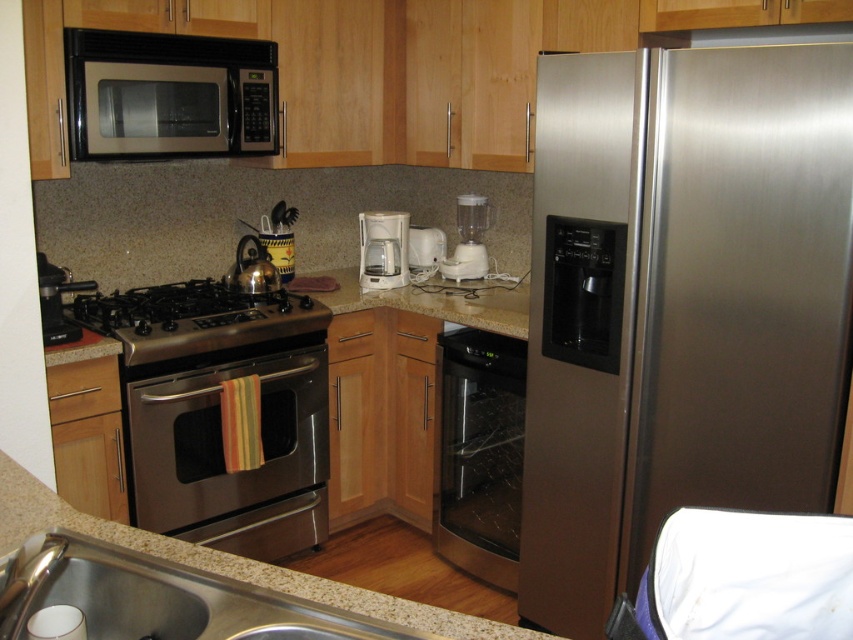
In the scene shown: You are organizing the kitchen and need to place a new appliance between the stainless steel refrigerator at right and the brushed metal sink at lower left. Based on their positions, which appliance should be placed closer to the sink?

The stainless steel refrigerator at right is positioned on the right side of the brushed metal sink at lower left, so the new appliance should be placed closer to the brushed metal sink at lower left to maintain the leftward flow of appliances.